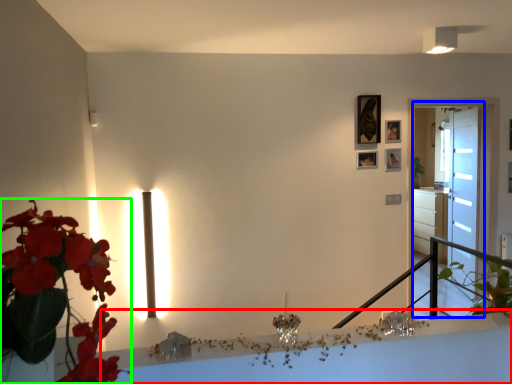
Question: Estimate the real-world distances between objects in this image. Which object is farther from table (highlighted by a red box), glass door (highlighted by a blue box) or houseplant (highlighted by a green box)?

Choices:
 (A) glass door
 (B) houseplant

Answer: (A)